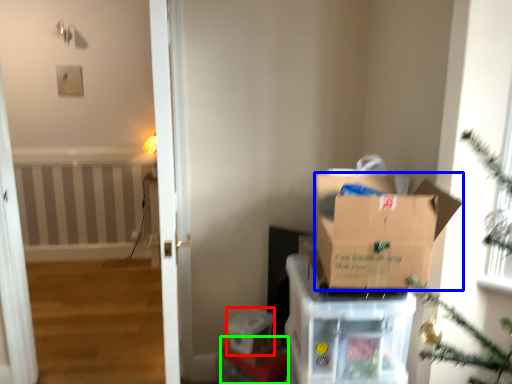
Question: Which object is the farthest from storage box (highlighted by a red box)? Choose among these: box (highlighted by a blue box) or furniture (highlighted by a green box).

Choices:
 (A) box
 (B) furniture

Answer: (A)